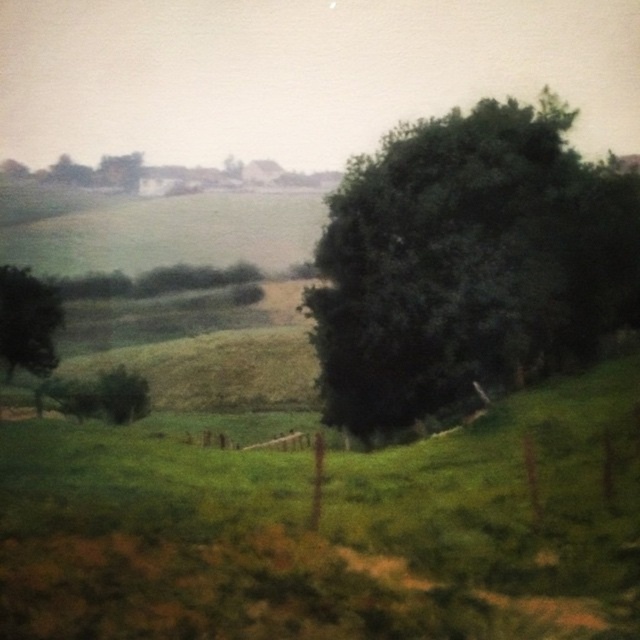
In the scene shown: Between green leafy tree at right and green matte tree at left, which one appears on the right side from the viewer's perspective?

green leafy tree at right

Is point (397, 326) farther from camera compared to point (22, 346)?

No, it is not.

At what (x,y) coordinates should I click in order to perform the action: click on green leafy tree at right. Please return your answer as a coordinate pair (x, y). The width and height of the screenshot is (640, 640). Looking at the image, I should click on (467, 262).